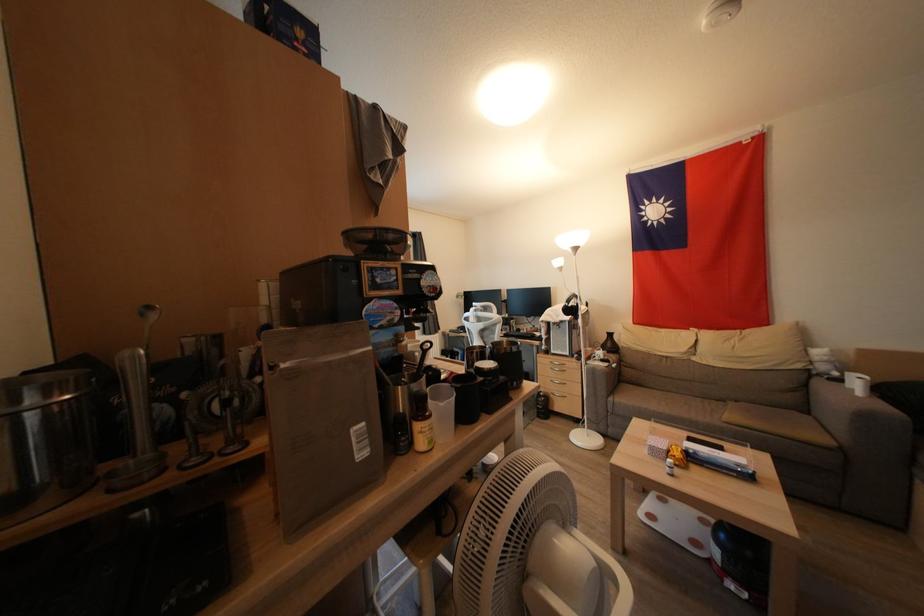
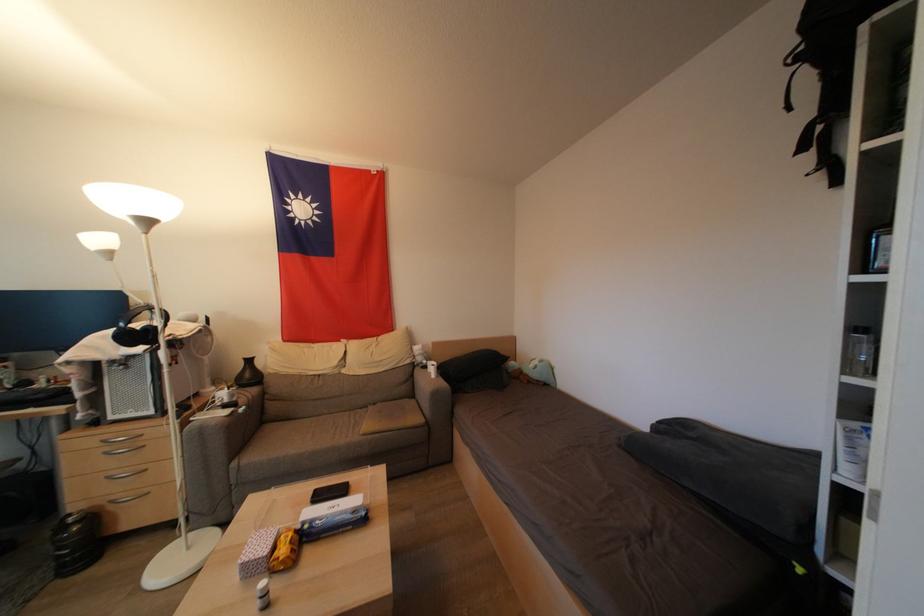
The point at (843, 384) is marked in the first image. Where is the corresponding point in the second image?

(430, 371)